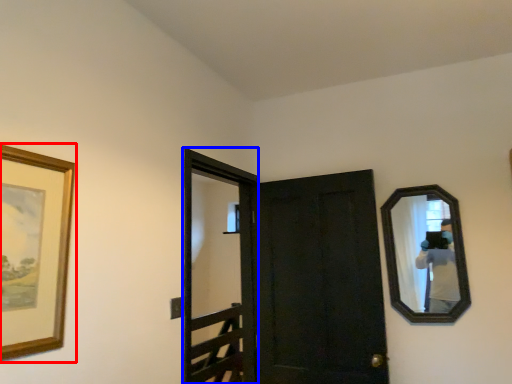
Question: Which object is closer to the camera taking this photo, picture frame (highlighted by a red box) or screen door (highlighted by a blue box)?

Choices:
 (A) picture frame
 (B) screen door

Answer: (A)